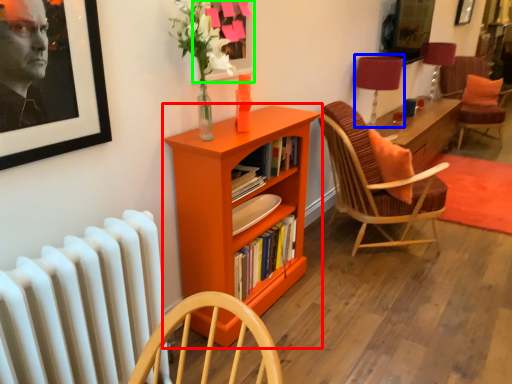
Question: Based on their relative distances, which object is nearer to bookcase (highlighted by a red box)? Choose from table lamp (highlighted by a blue box) and picture frame (highlighted by a green box).

Choices:
 (A) table lamp
 (B) picture frame

Answer: (B)